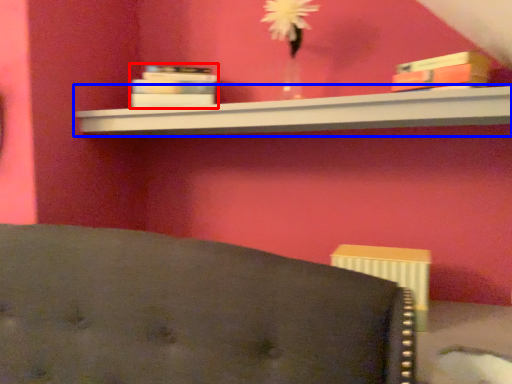
Question: Which of the following is the closest to the observer, book (highlighted by a red box) or shelf (highlighted by a blue box)?

Choices:
 (A) book
 (B) shelf

Answer: (B)